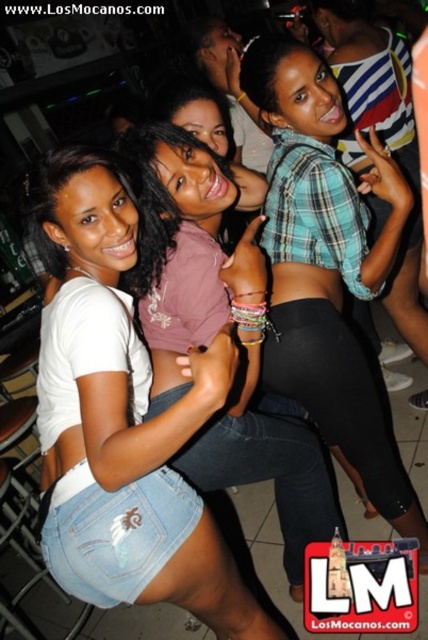
Consider the image. In the nightclub scene, there are two people wearing plaid fabric clothing at the center. The first is wearing a plaid fabric shirt at center, and the second is wearing a plaid fabric crop top at center. Which one is positioned to the left?

The plaid fabric shirt at center is to the left of the plaid fabric crop top at center.

Based on the photo, you are at a party and want to take a photo of the denim shorts at center and the plaid fabric shirt at center. Which one should you focus on first if you want to capture both clearly in your photo?

The denim shorts at center is located below the plaid fabric shirt at center, so you should focus on the plaid fabric shirt at center first to ensure both are in focus since it is closer to the camera.

You are a photographer at the party and want to ensure both the denim shorts at center and the plaid fabric shirt at center are clearly visible in your photo. Since the camera can only focus on one object at a time, which object should you choose to focus on to ensure it appears larger in the final image?

The denim shorts at center has a larger size compared to the plaid fabric shirt at center, so focusing on the denim shorts at center would ensure it appears larger in the photo.